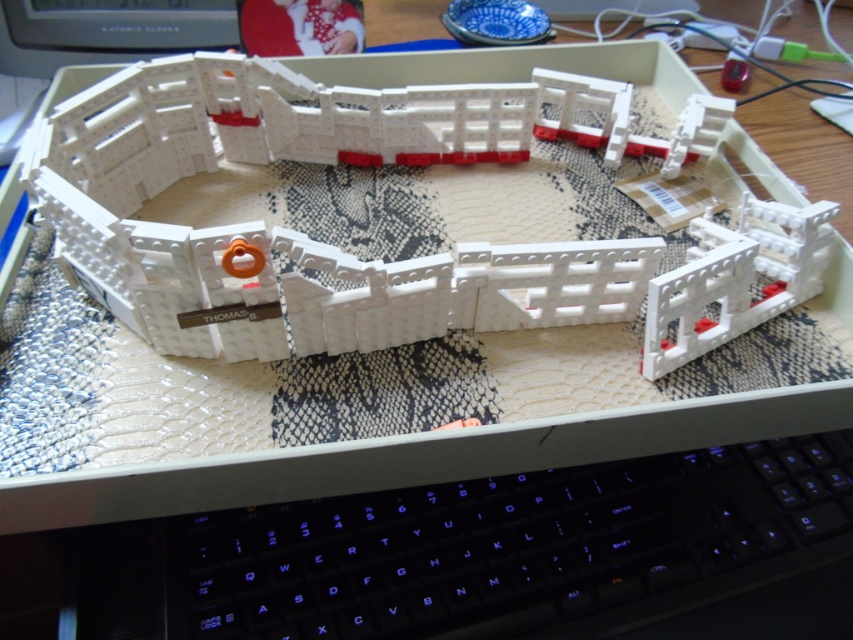
You are a photographer setting up a shot of the LEGO castle. You need to place a small white plastic toy at center to make the scene more dynamic. Where should you place it to match the coordinates given?

The white plastic toy at center should be placed at the coordinates point [265,163] to match the scene description.